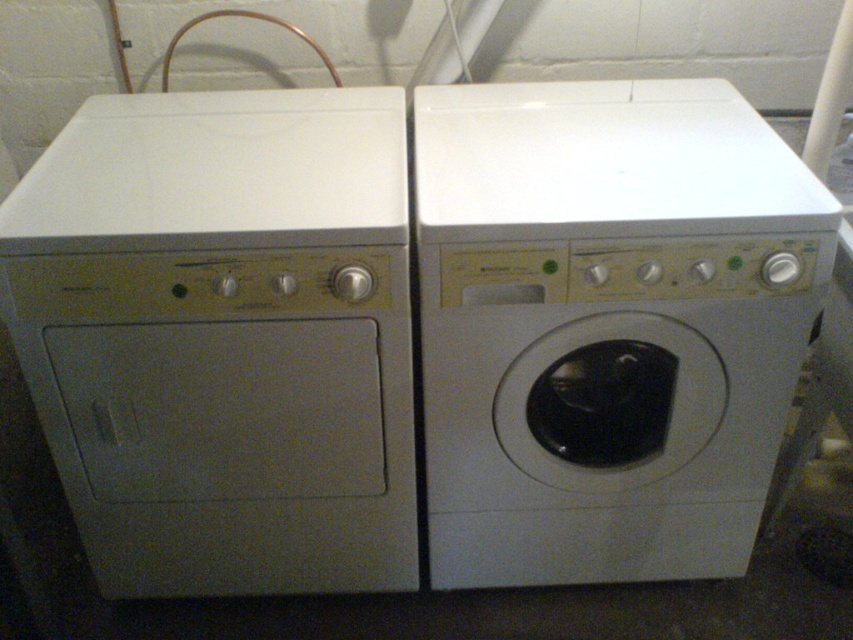
You are moving into a new apartment and see the white matte washing machine at left and the white glossy washing machine at center. Which one is placed higher up?

The white glossy washing machine at center is placed higher up because the white matte washing machine at left is positioned under it.

You are moving into a small apartment and need to choose between the white matte washing machine at left and the white glossy washing machine at center. Based on their sizes, which one would be more suitable for a space with limited room?

The white matte washing machine at left occupies less space than the white glossy washing machine at center, so it would be more suitable for a space with limited room.

Based on the photo, you are moving a new 14 inch wide vacuum cleaner into the space between the white matte washing machine at left and the white glossy washing machine at center. Will the vacuum cleaner fit in that space?

The space between the white matte washing machine at left and the white glossy washing machine at center is 13.60 inches. Since the vacuum cleaner is 14 inches wide, it will not fit in the space between them.